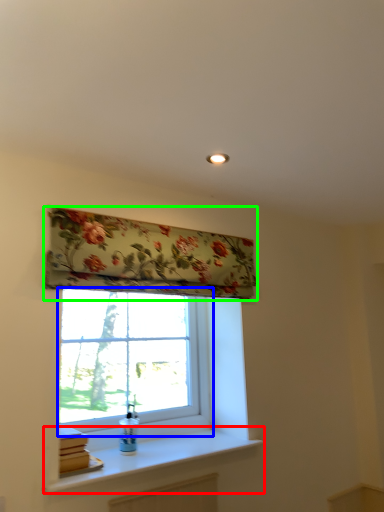
Question: Which is nearer to the window sill (highlighted by a red box)? window (highlighted by a blue box) or window blind (highlighted by a green box).

Choices:
 (A) window
 (B) window blind

Answer: (A)